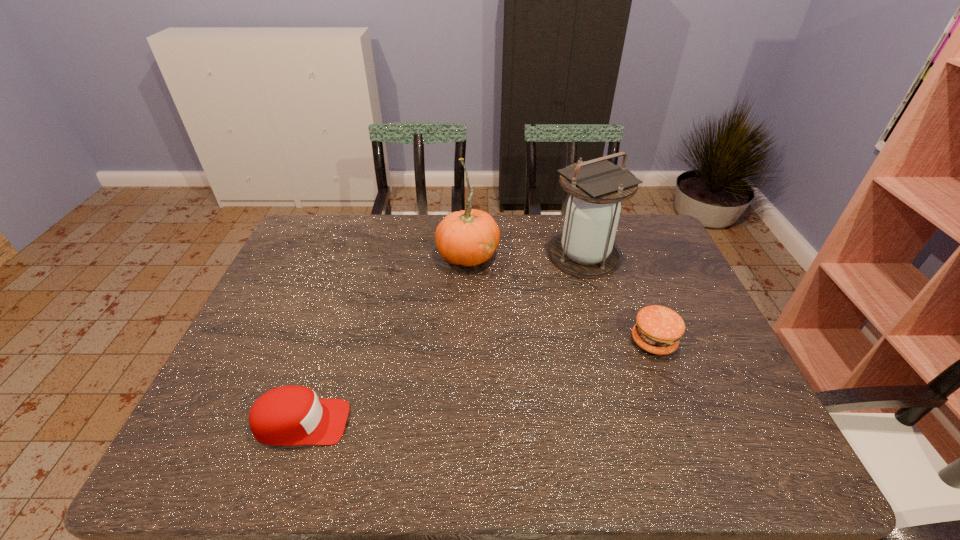
Locate an element on the screen. vacant space that's between the third farthest object and the baseball cap is located at coordinates (477, 382).

At what (x,y) coordinates should I click in order to perform the action: click on object that ranks as the third closest to the pumpkin. Please return your answer as a coordinate pair (x, y). The height and width of the screenshot is (540, 960). Looking at the image, I should click on click(289, 415).

At what (x,y) coordinates should I click in order to perform the action: click on object that can be found as the second closest to the second object from left to right. Please return your answer as a coordinate pair (x, y). This screenshot has width=960, height=540. Looking at the image, I should click on (657, 330).

Identify the location of vacant space that satisfies the following two spatial constraints: 1. on the front side of the second nearest object; 2. on the front-facing side of the leftmost object. (684, 422).

You are a GUI agent. You are given a task and a screenshot of the screen. Output one action in this format:
    pyautogui.click(x=<x>, y=<y>)
    Task: Click on the free space that satisfies the following two spatial constraints: 1. on the front side of the patty; 2. on the right side of the pumpkin
    
    Given the screenshot: What is the action you would take?
    pyautogui.click(x=466, y=342)

You are a GUI agent. You are given a task and a screenshot of the screen. Output one action in this format:
    pyautogui.click(x=<x>, y=<y>)
    Task: Click on the free location that satisfies the following two spatial constraints: 1. on the front side of the pumpkin; 2. on the front-facing side of the baseball cap
    
    Given the screenshot: What is the action you would take?
    pyautogui.click(x=463, y=422)